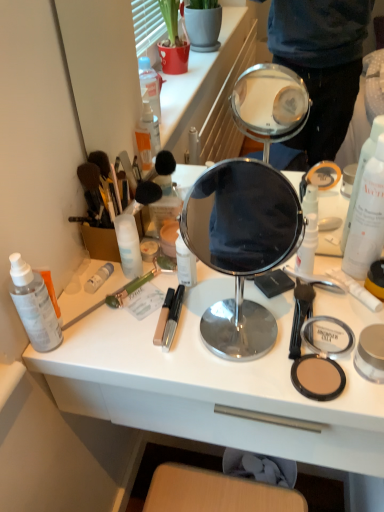
Image resolution: width=384 pixels, height=512 pixels. I want to click on vacant point to the right of white matte bottle at center-left, the 3th toiletry viewed from the right, so click(213, 289).